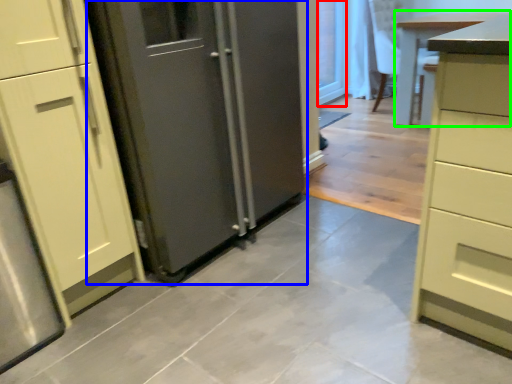
Question: Which is nearer to the glass door (highlighted by a red box)? door (highlighted by a blue box) or table (highlighted by a green box).

Choices:
 (A) door
 (B) table

Answer: (B)